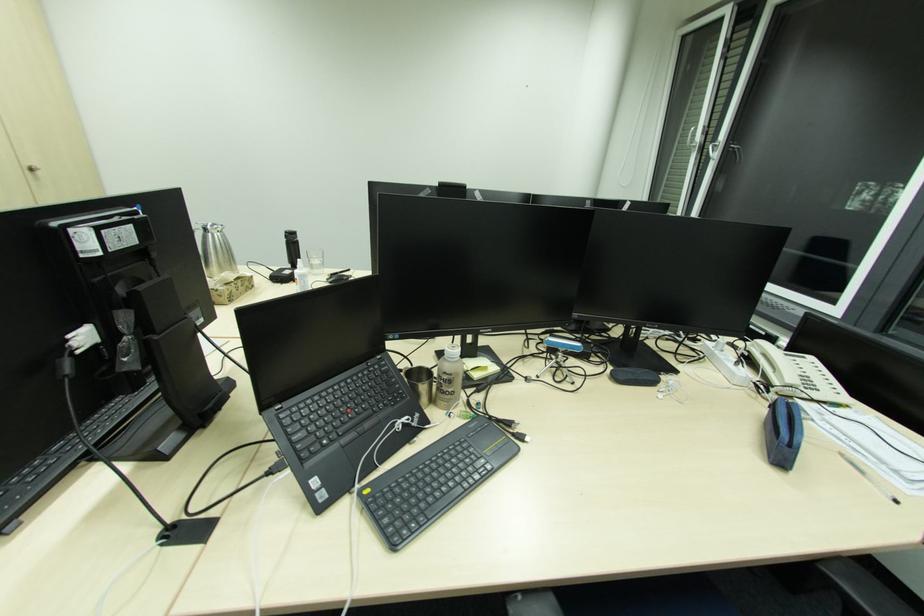
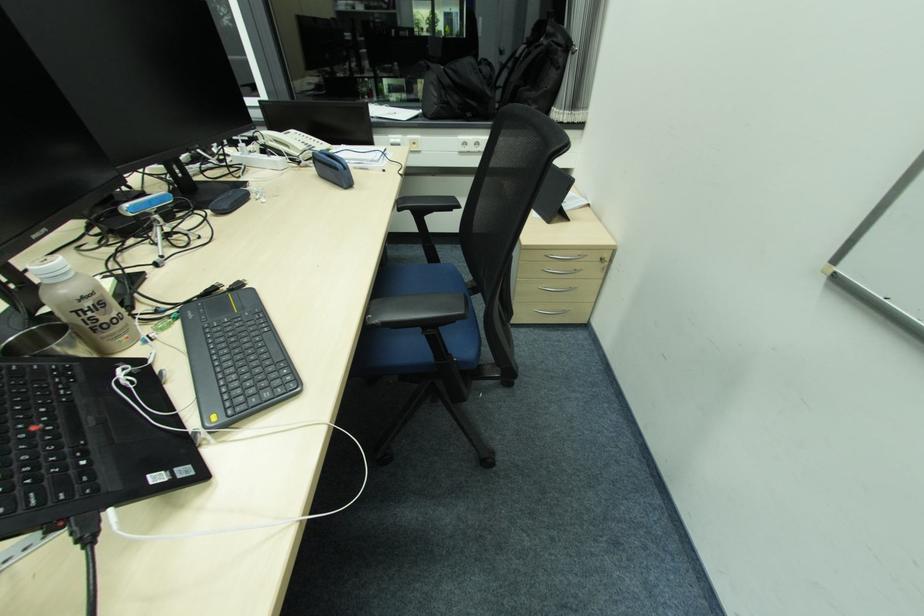
The first image is from the beginning of the video and the second image is from the end. How did the camera likely rotate when shooting the video?

The rotation direction of the camera is right-down.